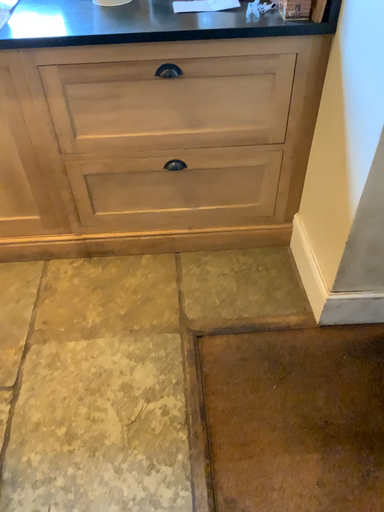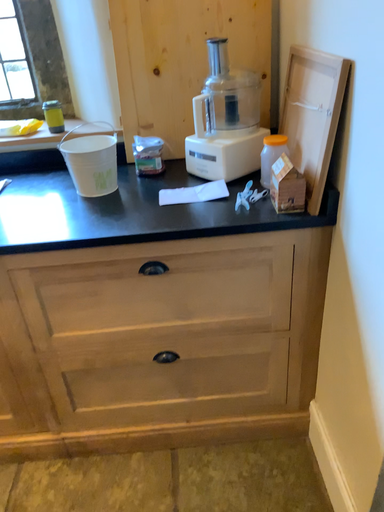
Question: How did the camera likely rotate when shooting the video?

Choices:
 (A) rotated downward
 (B) rotated upward

Answer: (B)